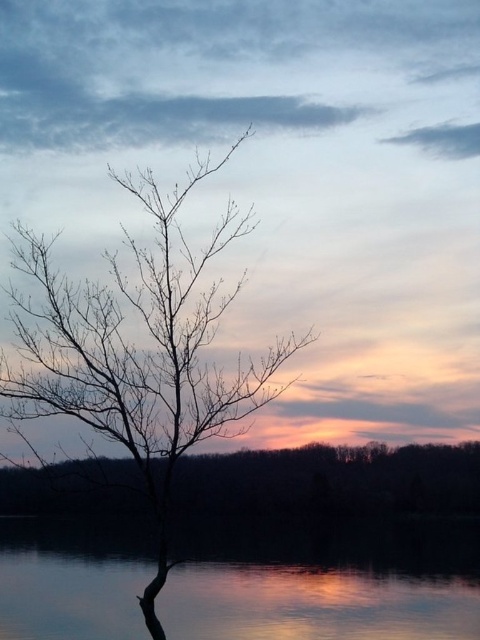
Is smooth water at lower center closer to the viewer compared to silhouette bark tree at center?

That is False.

Does smooth water at lower center come behind silhouette bark tree at center?

Yes, it is.

Between point (163, 625) and point (130, 368), which one is positioned in front?

Positioned in front is point (163, 625).

Find the location of a particular element. Image resolution: width=480 pixels, height=640 pixels. smooth water at lower center is located at coordinates (324, 582).